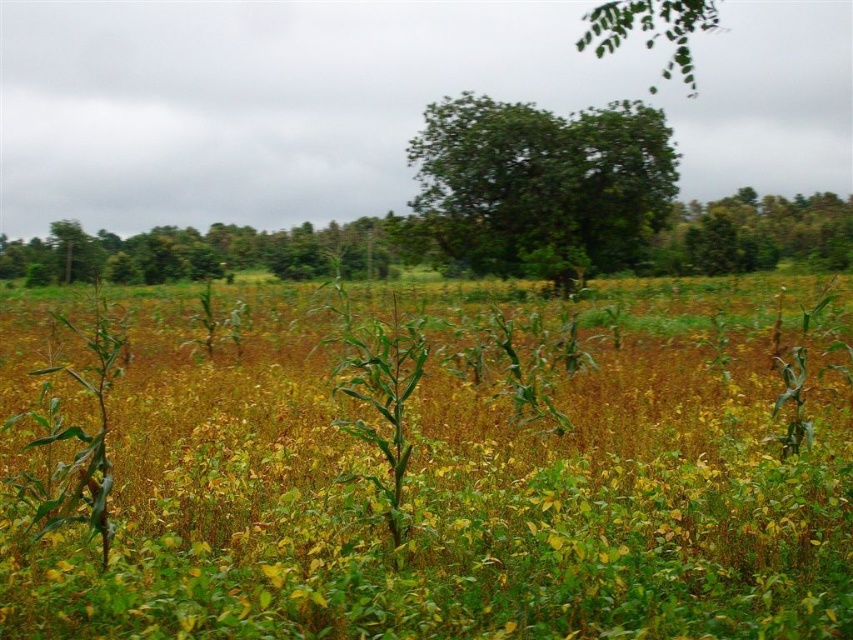
You are a farmer standing at the edge of your field. You notice the green grass at center and the green leafy tree at center. Which one is closer to you?

The green grass at center is closer to you because it is in front of the green leafy tree at center.

You are a farmer standing at the edge of the field. You notice the green grass at center and the green leafy tree at center. How far apart are these two objects from each other?

The green grass at center is 20.81 meters away from the green leafy tree at center.